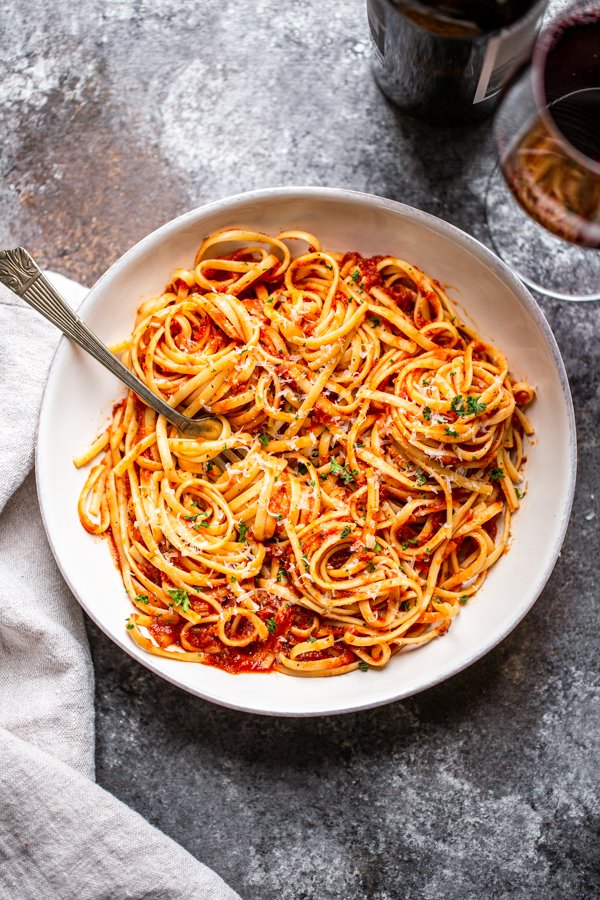
You are a GUI agent. You are given a task and a screenshot of the screen. Output one action in this format:
    pyautogui.click(x=<x>, y=<y>)
    Task: Click on the bottle
    The width and height of the screenshot is (600, 900).
    Given the screenshot: What is the action you would take?
    pyautogui.click(x=480, y=48)